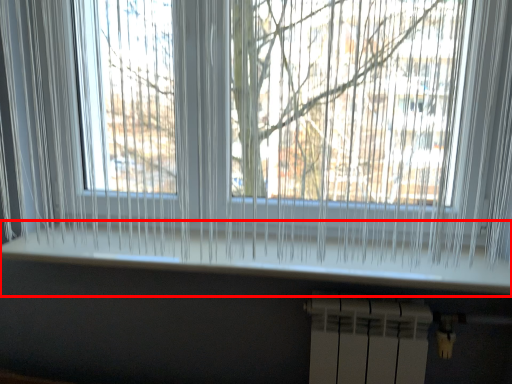
Question: From the image's perspective, where is window sill (annotated by the red box) located in relation to radiator in the image?

Choices:
 (A) below
 (B) above

Answer: (B)